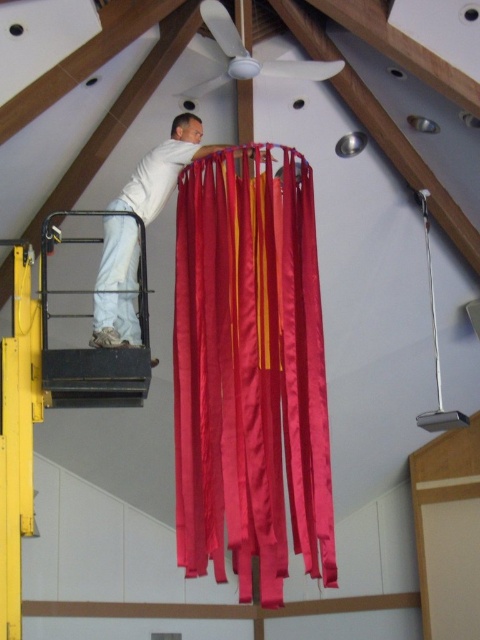
From the picture: You are standing in the room and want to reach the white matte fan at upper center to clean it. The black metal lift at lower left is available. Can you use the lift to reach the fan?

The black metal lift at lower left is located below the white matte fan at upper center, so the lift can be positioned under the fan to allow access for cleaning.

You are standing in the room and see two points marked on the ceiling. The first point is at coordinate point(178, 458) and the second is at point(192, 88). Which point is closer to you?

Point(178, 458) is in front of point(192, 88), so it is closer to you.

You are standing in the room and want to reach a specific point marked as point (72, 374). You have a ladder that is 18 feet long. Can you safely reach that point with your ladder?

The distance of point (72, 374) from viewer is 19.12 feet, so the ladder is 18 feet long which is shorter than the required distance. Therefore, you cannot safely reach the point with the ladder.